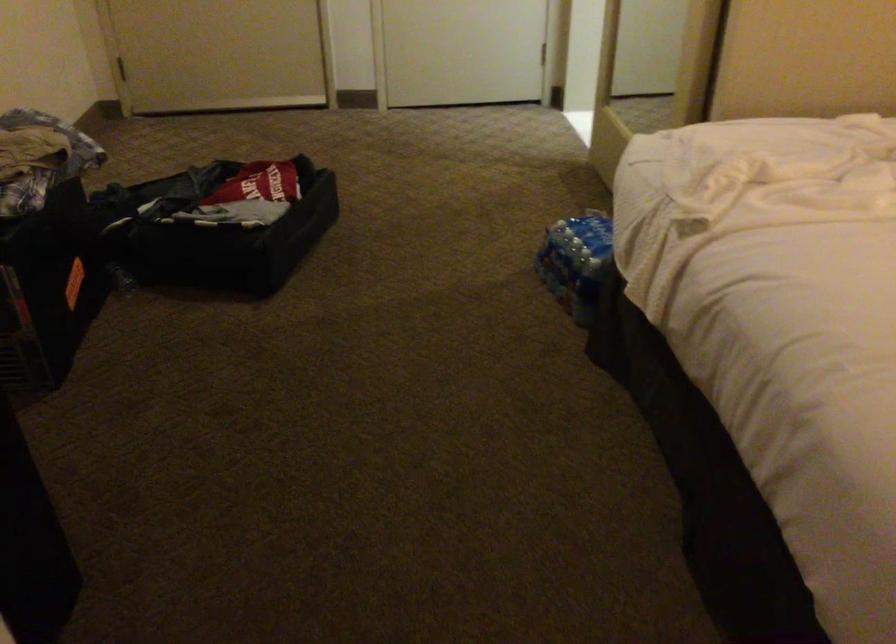
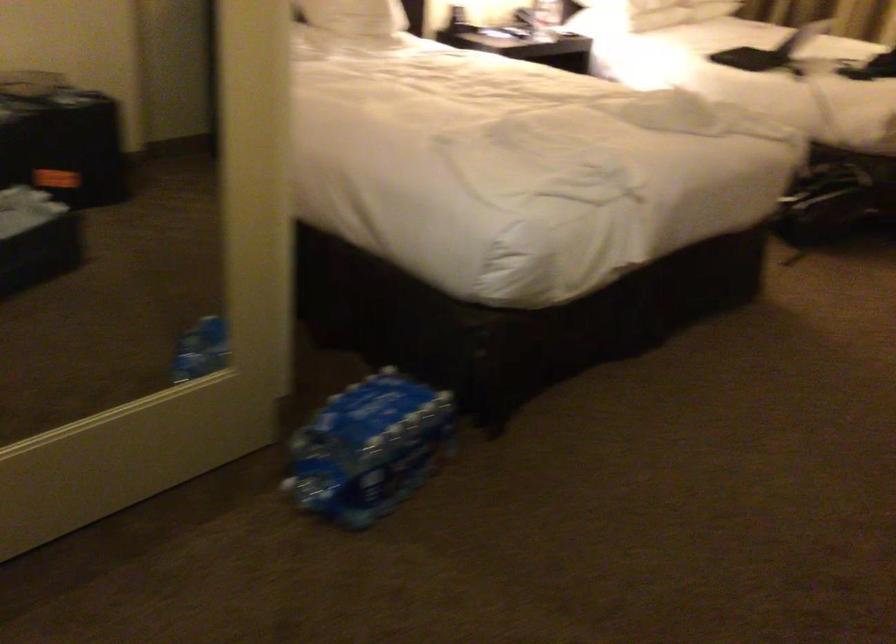
Find the pixel in the second image that matches (563,225) in the first image.

(367, 448)